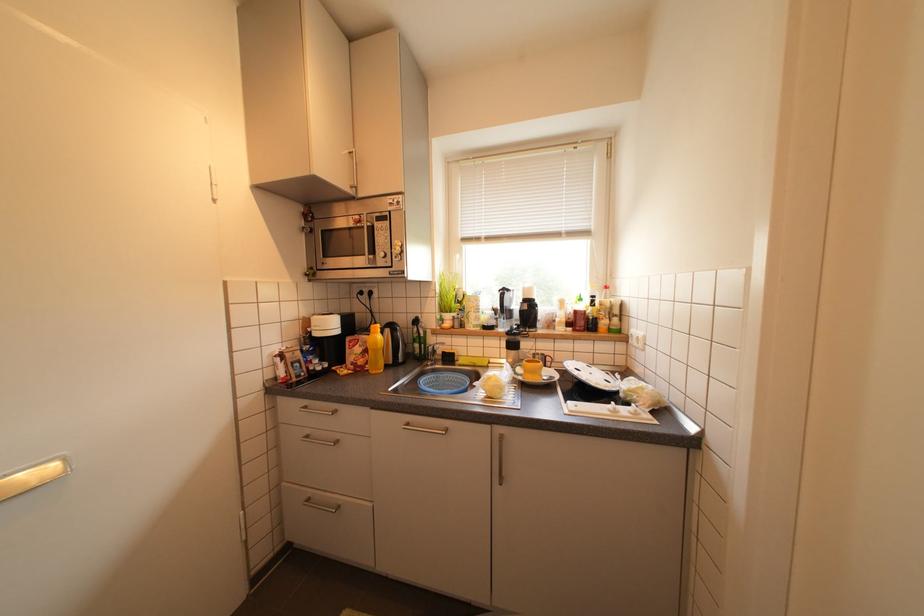
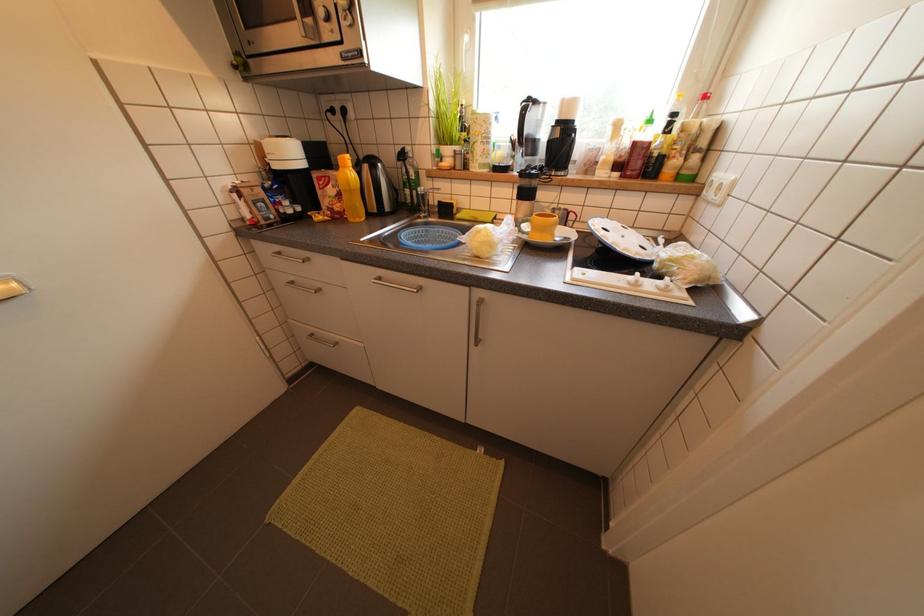
Question: How did the camera likely rotate?

Choices:
 (A) Left
 (B) Right
 (C) Up
 (D) Down

Answer: (D)